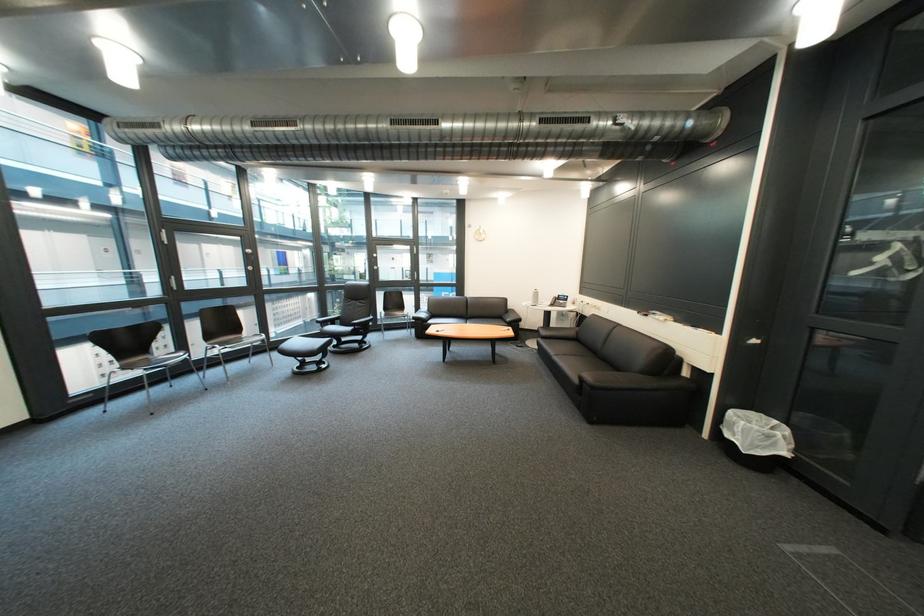
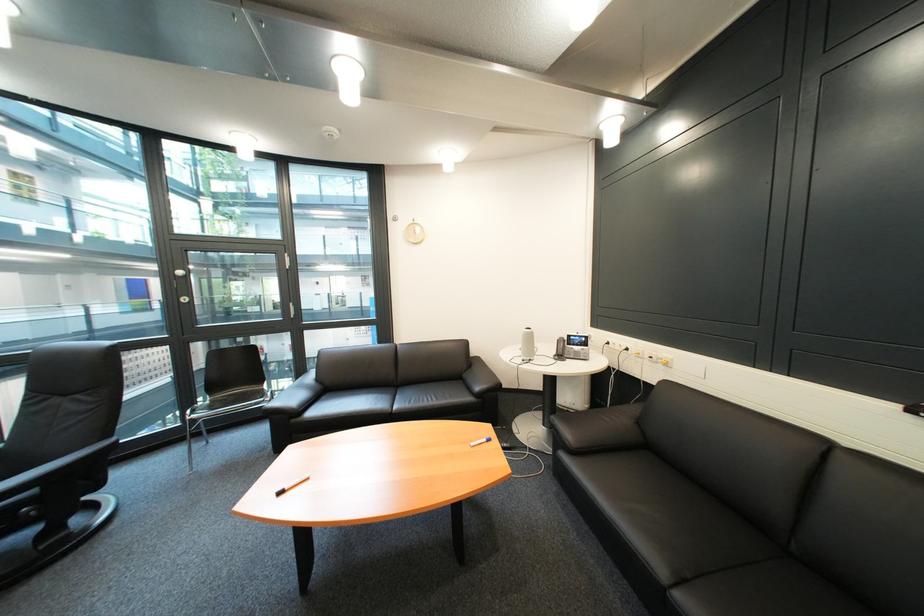
Question: In a continuous first-person perspective shot, in which direction is the camera moving?

Choices:
 (A) Left
 (B) Right
 (C) Forward
 (D) Backward

Answer: (C)